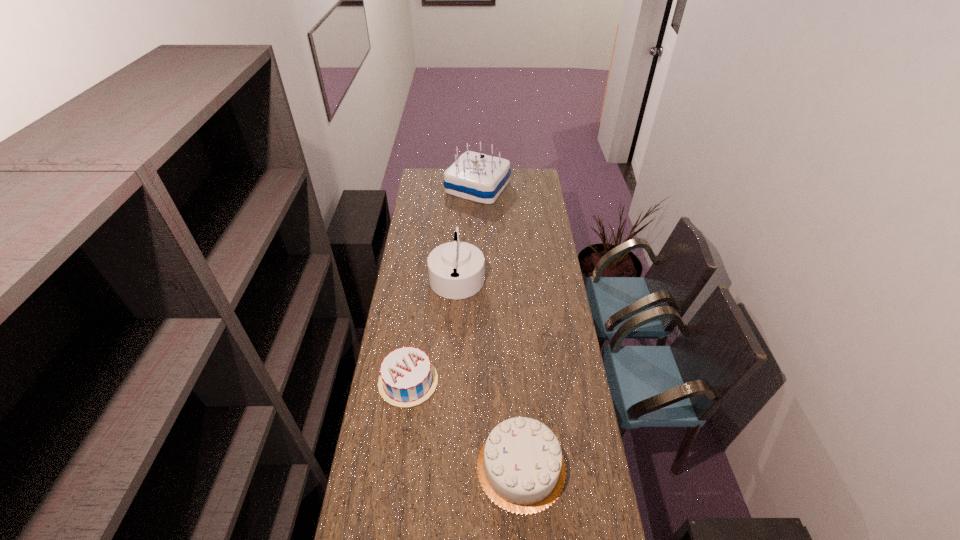
Identify which birthday cake is the second closest to the farthest object. Please provide its 2D coordinates. Your answer should be formatted as a tuple, i.e. [(x, y)], where the tuple contains the x and y coordinates of a point satisfying the conditions above.

[(521, 468)]

What are the coordinates of `birthday cake that can be found as the second closest to the kettle` in the screenshot? It's located at (474, 176).

At what (x,y) coordinates should I click in order to perform the action: click on free spot that satisfies the following two spatial constraints: 1. on the back side of the third tallest object; 2. on the spout of the kettle. Please return your answer as a coordinate pair (x, y). Looking at the image, I should click on (509, 275).

Where is `vacant space that satisfies the following two spatial constraints: 1. on the spout of the kettle; 2. on the right side of the second shortest birthday cake`? Image resolution: width=960 pixels, height=540 pixels. vacant space that satisfies the following two spatial constraints: 1. on the spout of the kettle; 2. on the right side of the second shortest birthday cake is located at coordinates (447, 467).

Image resolution: width=960 pixels, height=540 pixels. In order to click on vacant space that satisfies the following two spatial constraints: 1. on the spout of the third shortest object; 2. on the front side of the second farthest birthday cake in this screenshot , I will do (x=451, y=382).

Image resolution: width=960 pixels, height=540 pixels. What are the coordinates of `free location that satisfies the following two spatial constraints: 1. on the spout of the nearest birthday cake; 2. on the left side of the kettle` in the screenshot? It's located at 447,467.

In order to click on vacant area in the image that satisfies the following two spatial constraints: 1. on the back side of the nearest object; 2. on the spout of the third nearest object in this screenshot , I will do `click(509, 275)`.